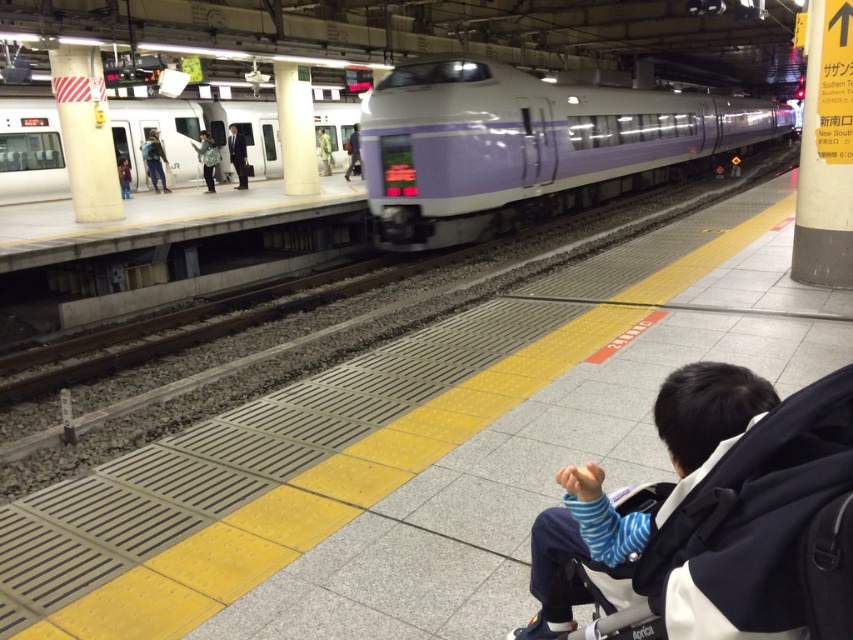
You are a passenger on the platform and want to board the train. You see the white glossy train at left and the light blue denim jacket at upper left. Which object is wider? Please answer based on their widths.

The white glossy train at left is wider than the light blue denim jacket at upper left according to their widths.

You are a passenger waiting at the train station platform. You notice a white glossy train at left and a light blue denim jacket at upper left. Which object is nearer to you?

The white glossy train at left is closer to you than the light blue denim jacket at upper left.